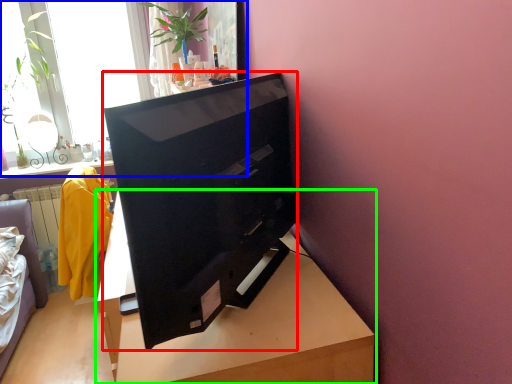
Question: Which object is the farthest from television (highlighted by a red box)? Choose among these: window (highlighted by a blue box) or table (highlighted by a green box).

Choices:
 (A) window
 (B) table

Answer: (A)